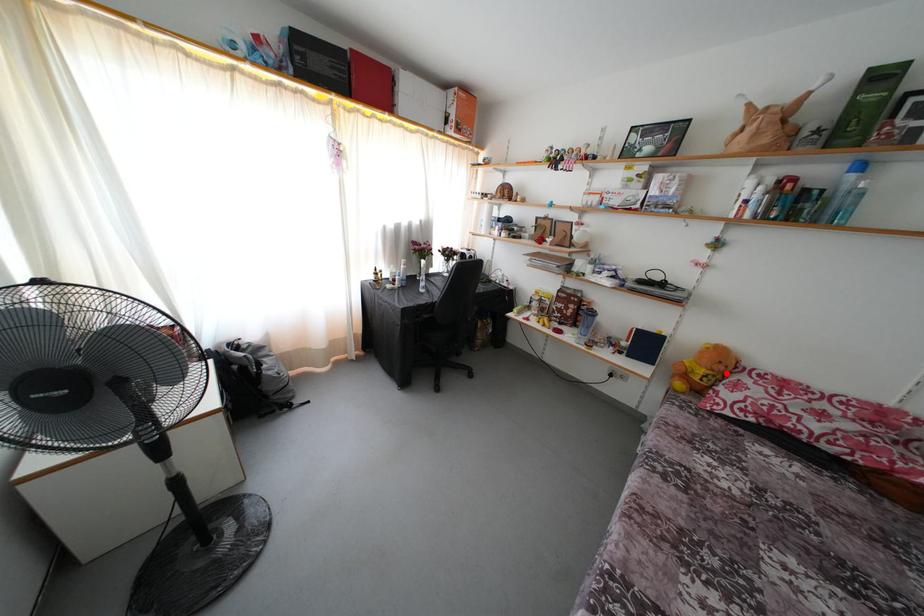
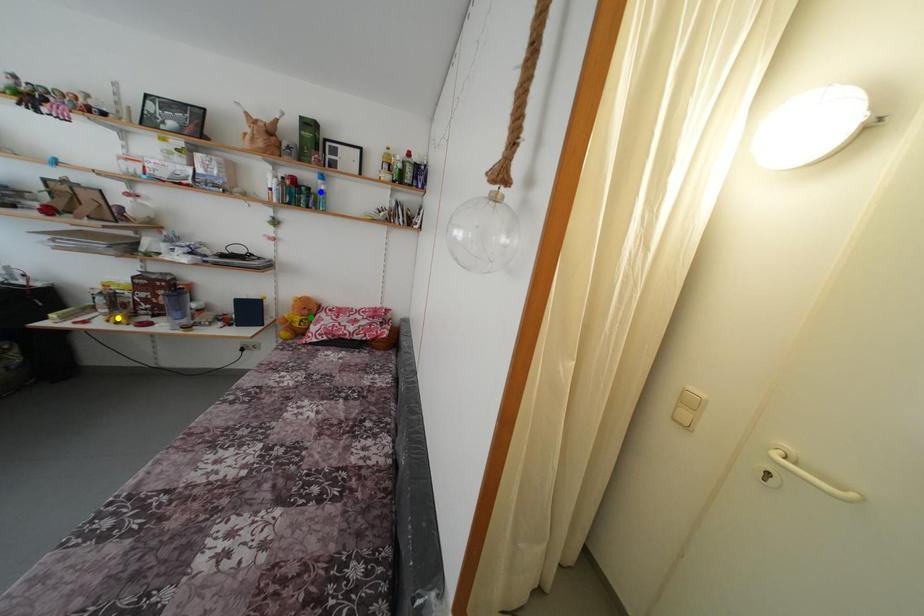
Question: I am providing you with two images of the same scene from different viewpoints. A red point is marked on the first image. You are given multiple points on the second image. Can you choose the point in image 2 that corresponds to the point in image 1?

Choices:
 (A) yellow point
 (B) blue point
 (C) green point

Answer: (C)